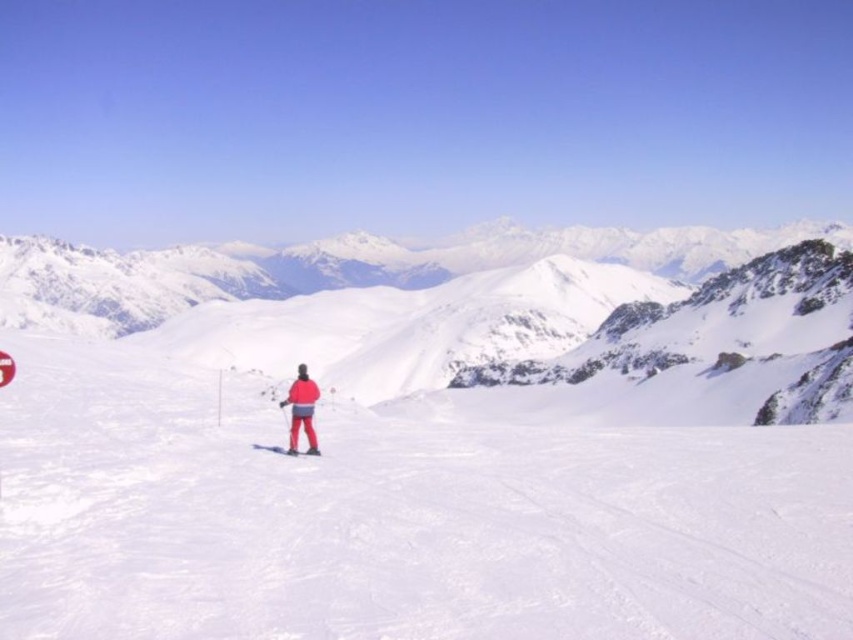
Is point (315, 435) closer to viewer compared to point (260, 445)?

That is False.

Is matte red jacket at center taller than matte red ski at center?

Yes.

Locate an element on the screen. Image resolution: width=853 pixels, height=640 pixels. matte red jacket at center is located at coordinates (300, 410).

Is white powdery snow at center taller than matte red ski at center?

Indeed, white powdery snow at center has a greater height compared to matte red ski at center.

Is white powdery snow at center above matte red ski at center?

Yes.

Does point (372, 385) lie behind point (268, 448)?

Yes.

The height and width of the screenshot is (640, 853). I want to click on white powdery snow at center, so click(x=432, y=445).

Does white powdery snow at center appear on the right side of matte red jacket at center?

Yes, white powdery snow at center is to the right of matte red jacket at center.

Does point (793, 323) come closer to viewer compared to point (279, 404)?

No, it is not.

Locate an element on the screen. Image resolution: width=853 pixels, height=640 pixels. white powdery snow at center is located at coordinates (432, 445).

Locate an element on the screen. white powdery snow at center is located at coordinates (432, 445).